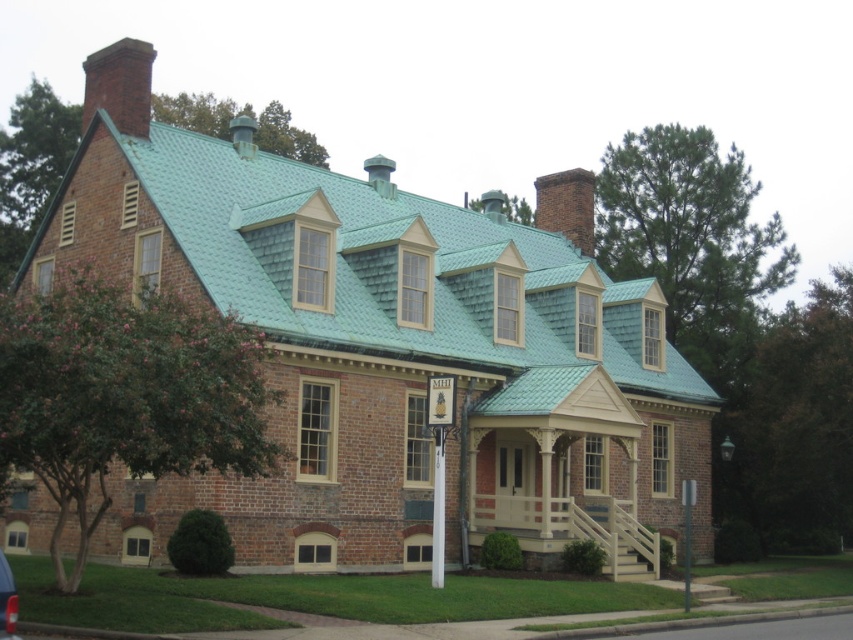
Between brick chimney at upper left and metallic silver pole at lower right, which one has less height?

Standing shorter between the two is metallic silver pole at lower right.

Between brick chimney at upper left and metallic silver pole at lower right, which one is positioned lower?

metallic silver pole at lower right

Is point (128, 60) less distant than point (695, 486)?

That is False.

Locate an element on the screen. This screenshot has height=640, width=853. brick chimney at upper left is located at coordinates (119, 84).

Which of these two, teal shingles at center or beige painted wood porch at center, stands taller?

With more height is teal shingles at center.

How distant is teal shingles at center from beige painted wood porch at center?

teal shingles at center is 12.84 meters away from beige painted wood porch at center.

Between point (436, 237) and point (630, 566), which one is positioned in front?

Point (630, 566)

The image size is (853, 640). What are the coordinates of `teal shingles at center` in the screenshot? It's located at (373, 262).

Can you confirm if teal shingles at center is shorter than brick chimney at upper left?

Indeed, teal shingles at center has a lesser height compared to brick chimney at upper left.

Who is more forward, (341, 282) or (125, 64)?

Point (125, 64)

Locate an element on the screen. This screenshot has width=853, height=640. teal shingles at center is located at coordinates (373, 262).